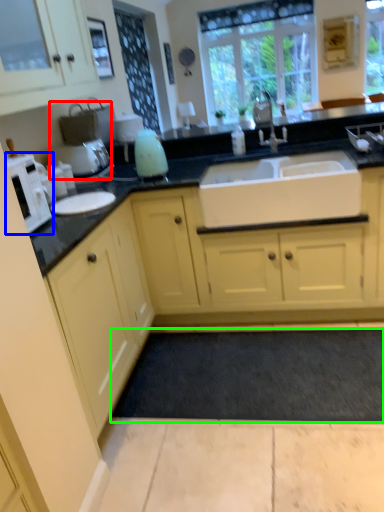
Question: Considering the real-world distances, which object is farthest from coffee machine (highlighted by a red box)? microwave (highlighted by a blue box) or plain (highlighted by a green box)?

Choices:
 (A) microwave
 (B) plain

Answer: (B)